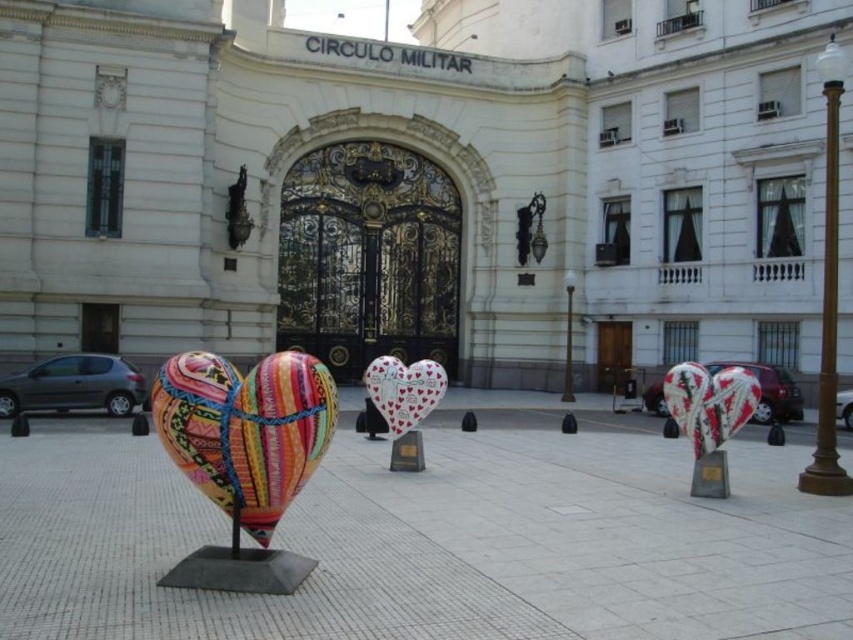
You are an art student visiting the CIRCULO MILITAR building. You notice two artworks in the square. The first is the brightly painted fabric heart at center and the second is the polished bronze statue at upper left. Which artwork is taller?

The polished bronze statue at upper left is taller than the brightly painted fabric heart at center.

You are an event organizer planning to place a new sculpture in the public square. The new sculpture is 1.2 meters wide. You want to place it between the brightly painted fabric heart at center and the textured fabric heart at center. Will the new sculpture fit between them without overlapping?

The brightly painted fabric heart at center is wider than the textured fabric heart at center. Since the new sculpture is 1.2 meters wide, we need to know the exact widths of both hearts to determine if there is enough space. However, the description only states that the brightly painted one is larger in width, but does not provide specific measurements. Therefore, it is uncertain if the new sculpture will fit without overlapping.

You are an event planner setting up a photo booth in the public square. You have two hearts, a textured fabric heart at center and a white glossy heart at center. Which heart should you choose if you want the one that is bigger?

The textured fabric heart at center is larger in size compared to the white glossy heart at center, so you should choose the textured fabric heart at center for the bigger option.